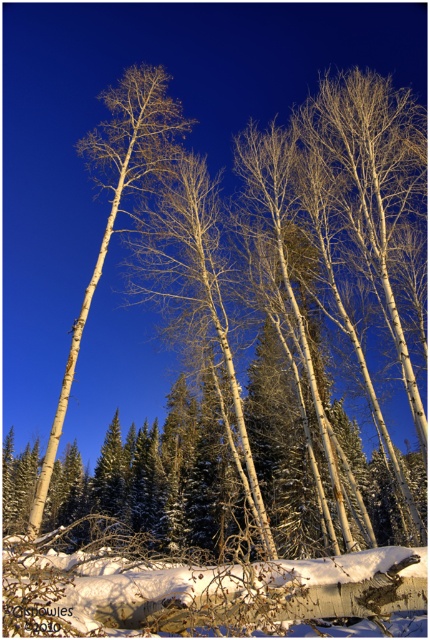
You are standing in the winter landscape and want to place a small decorative snowman exactly where the white fluffy snow at lower center is located. According to the coordinates provided, is the snowman placement feasible at that exact point?

The white fluffy snow at lower center is located at point (205, 593), so yes, the snowman can be placed exactly at that coordinate since the snow is present there.